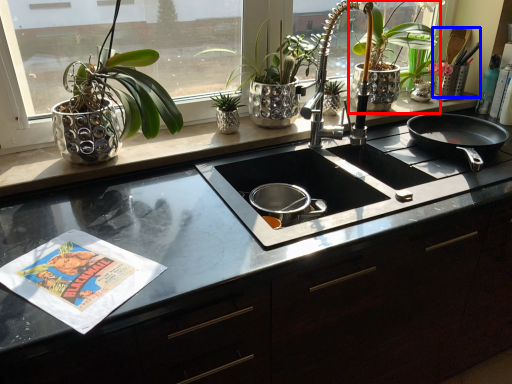
Question: Which point is closer to the camera, houseplant (highlighted by a red box) or appliance (highlighted by a blue box)?

Choices:
 (A) houseplant
 (B) appliance

Answer: (A)